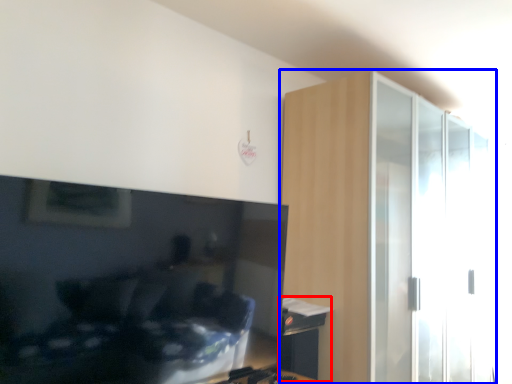
Question: Which object appears farthest to the camera in this image, table (highlighted by a red box) or dresser (highlighted by a blue box)?

Choices:
 (A) table
 (B) dresser

Answer: (A)